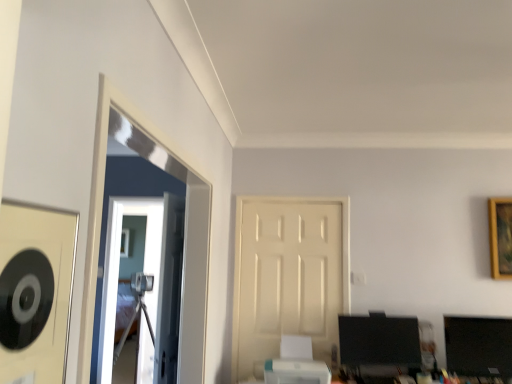
Question: From a real-world perspective, is white plastic printer at lower center positioned under gold wooden picture frame at upper right based on gravity?

Choices:
 (A) yes
 (B) no

Answer: (A)

Question: Does white plastic printer at lower center have a greater height compared to gold wooden picture frame at upper right?

Choices:
 (A) yes
 (B) no

Answer: (B)

Question: Does white plastic printer at lower center contain gold wooden picture frame at upper right?

Choices:
 (A) no
 (B) yes

Answer: (A)

Question: Is white plastic printer at lower center looking in the opposite direction of gold wooden picture frame at upper right?

Choices:
 (A) yes
 (B) no

Answer: (B)

Question: Is white plastic printer at lower center far from gold wooden picture frame at upper right?

Choices:
 (A) no
 (B) yes

Answer: (B)

Question: Does white plastic printer at lower center lie in front of gold wooden picture frame at upper right?

Choices:
 (A) yes
 (B) no

Answer: (A)

Question: Can you confirm if matte black monitor at lower right is bigger than gold wooden picture frame at upper right?

Choices:
 (A) no
 (B) yes

Answer: (B)

Question: Is gold wooden picture frame at upper right at the back of matte black monitor at lower right?

Choices:
 (A) yes
 (B) no

Answer: (B)

Question: Are matte black monitor at lower right and gold wooden picture frame at upper right beside each other?

Choices:
 (A) yes
 (B) no

Answer: (B)

Question: From the image's perspective, is matte black monitor at lower right under gold wooden picture frame at upper right?

Choices:
 (A) no
 (B) yes

Answer: (B)

Question: Does matte black monitor at lower right come in front of gold wooden picture frame at upper right?

Choices:
 (A) no
 (B) yes

Answer: (B)

Question: From a real-world perspective, does matte black monitor at lower right stand above gold wooden picture frame at upper right?

Choices:
 (A) no
 (B) yes

Answer: (A)

Question: From a real-world perspective, is white matte door at center positioned under transparent glass door at center based on gravity?

Choices:
 (A) no
 (B) yes

Answer: (A)